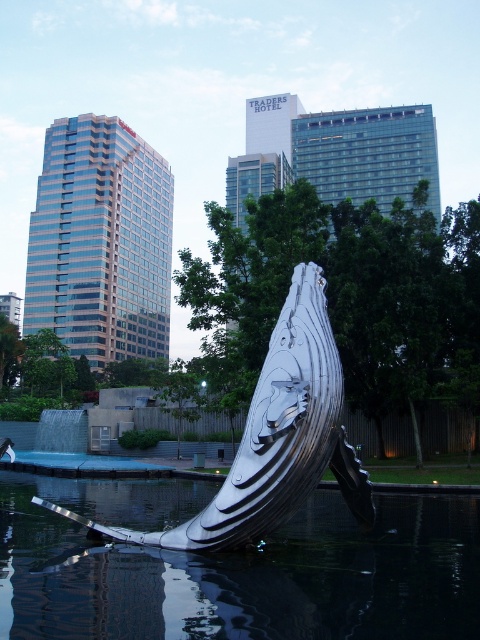
Does metallic water at lower center have a lesser width compared to polished silver whale at center?

No.

Is metallic water at lower center to the right of polished silver whale at center from the viewer's perspective?

Incorrect, metallic water at lower center is not on the right side of polished silver whale at center.

You are a GUI agent. You are given a task and a screenshot of the screen. Output one action in this format:
    pyautogui.click(x=<x>, y=<y>)
    Task: Click on the metallic water at lower center
    This screenshot has height=640, width=480.
    Given the screenshot: What is the action you would take?
    pyautogui.click(x=235, y=568)